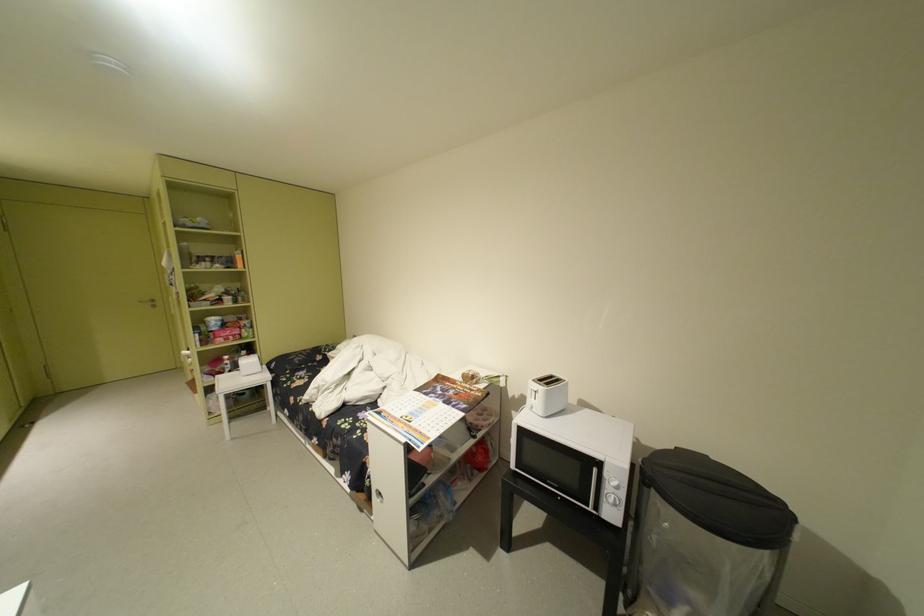
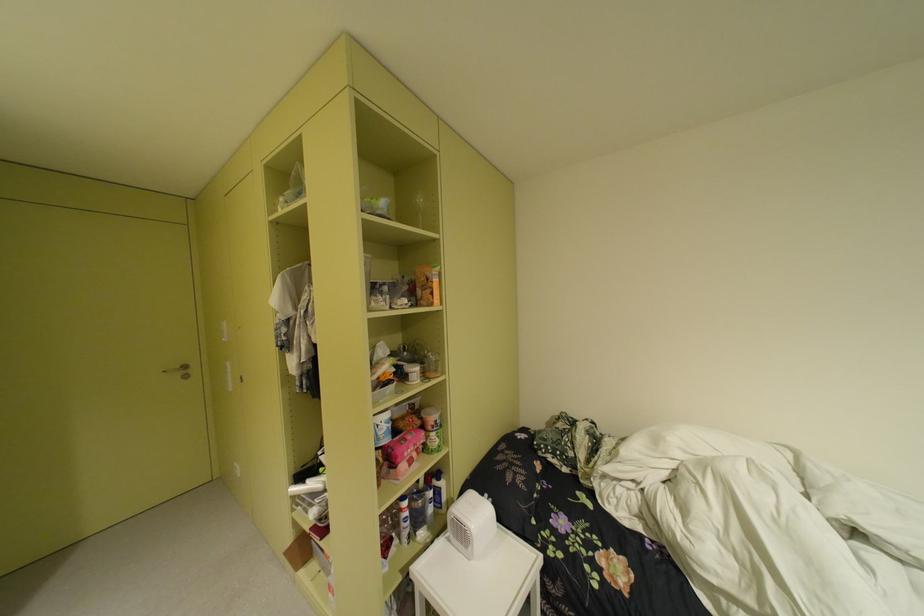
Locate, in the second image, the point that corresponds to (246,302) in the first image.

(434, 376)